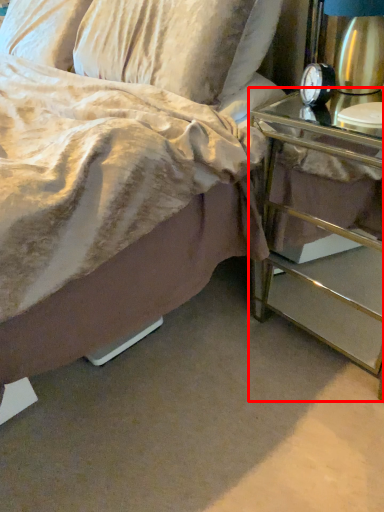
Question: From the image's perspective, where is nightstand (annotated by the red box) located relative to alarm clock?

Choices:
 (A) below
 (B) above

Answer: (A)